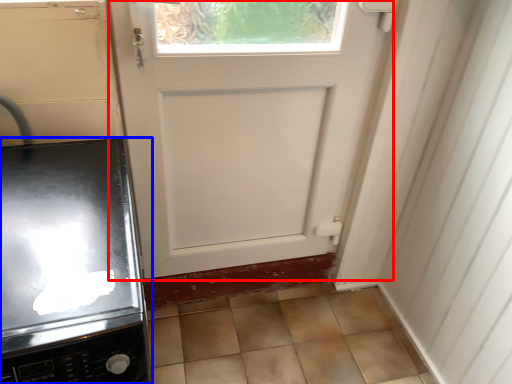
Question: Which point is further to the camera, door (highlighted by a red box) or home appliance (highlighted by a blue box)?

Choices:
 (A) door
 (B) home appliance

Answer: (A)